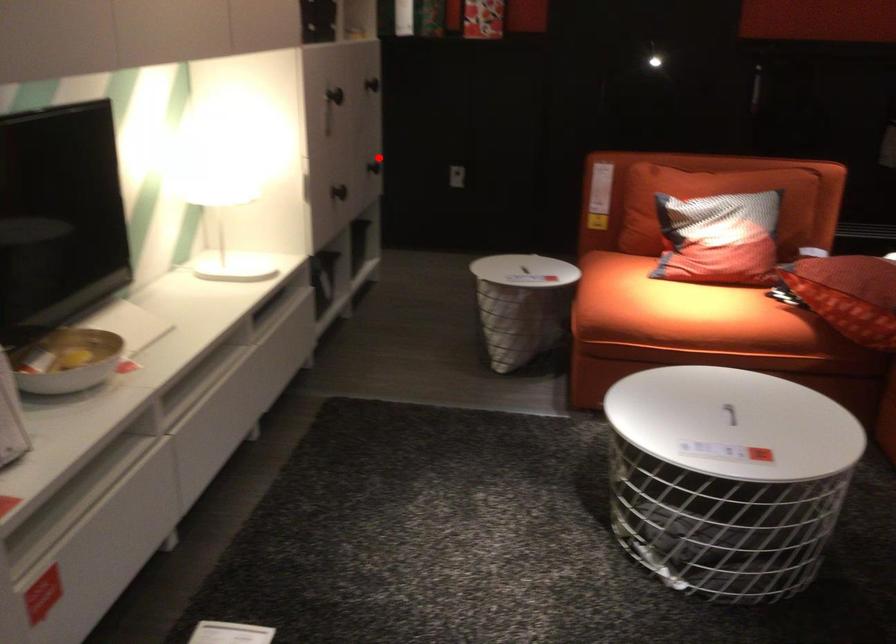
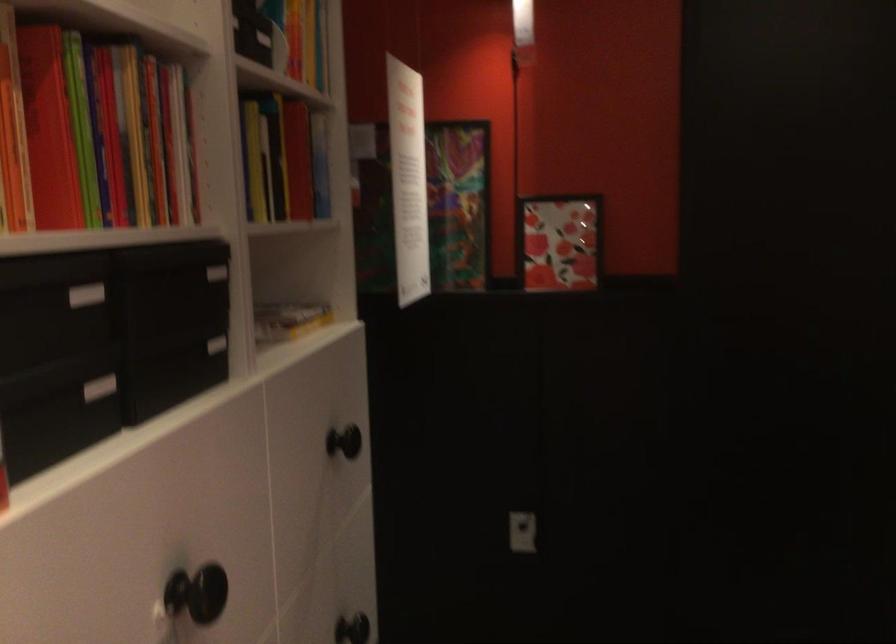
Question: I am providing you with two images of the same scene from different viewpoints. Image1 has a red point marked. In image2, the corresponding 3D location appears at what relative position? Reply with the corresponding letter.

Choices:
 (A) Closer
 (B) Farther

Answer: (A)